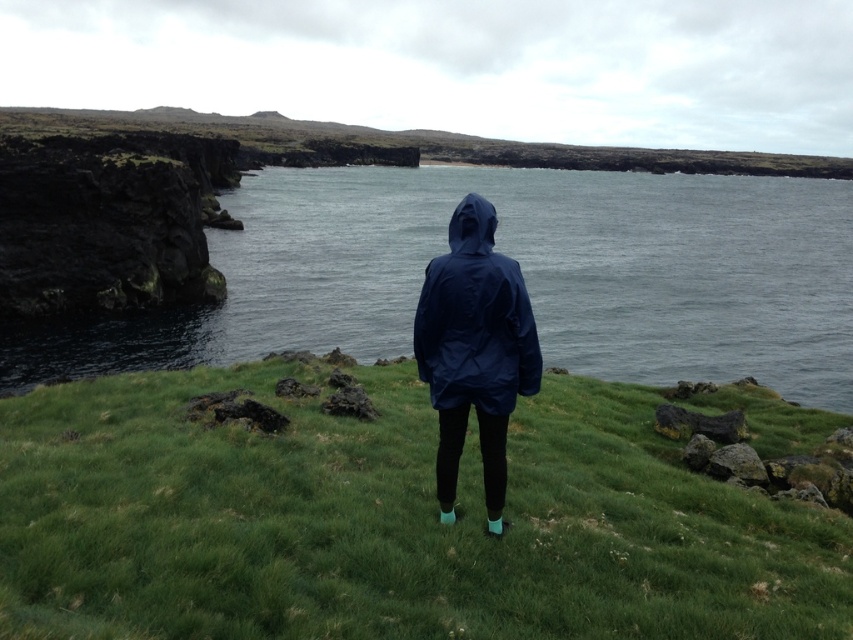
Is green grassy at center below navy blue waterproof jacket at center?

Correct, green grassy at center is located below navy blue waterproof jacket at center.

Is green grassy at center to the left of navy blue waterproof jacket at center from the viewer's perspective?

No, green grassy at center is not to the left of navy blue waterproof jacket at center.

Does point (741, 618) come closer to viewer compared to point (485, 252)?

Yes, point (741, 618) is in front of point (485, 252).

Find the location of `green grassy at center`. green grassy at center is located at coordinates (387, 522).

Who is shorter, green grassy at center or blue matte hood at center?

blue matte hood at center is shorter.

Is point (407, 548) less distant than point (491, 250)?

Yes.

Image resolution: width=853 pixels, height=640 pixels. Find the location of `green grassy at center`. green grassy at center is located at coordinates (387, 522).

Is green grassy at center above smooth gray water at center?

Incorrect, green grassy at center is not positioned above smooth gray water at center.

Is green grassy at center to the right of smooth gray water at center from the viewer's perspective?

No, green grassy at center is not to the right of smooth gray water at center.

In order to click on green grassy at center in this screenshot , I will do `click(387, 522)`.